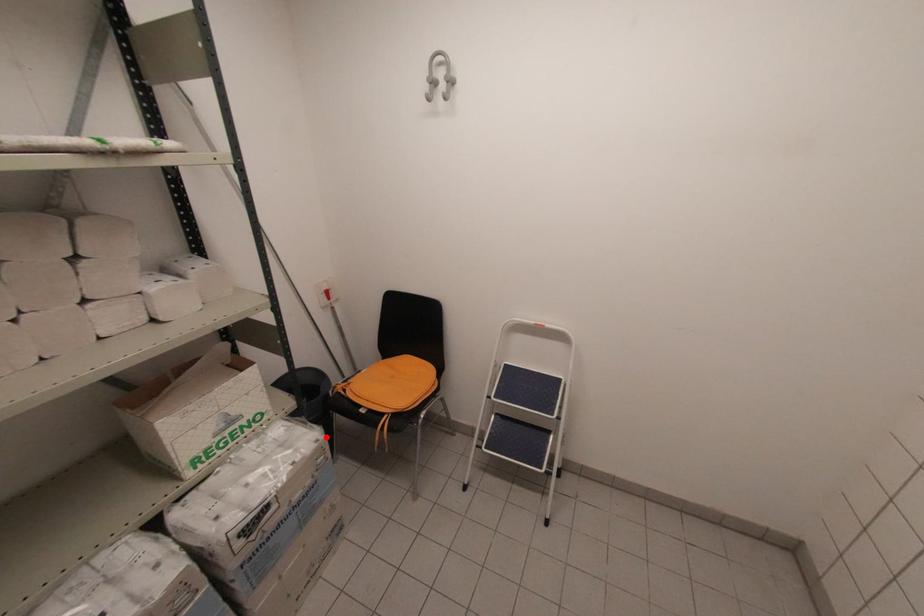
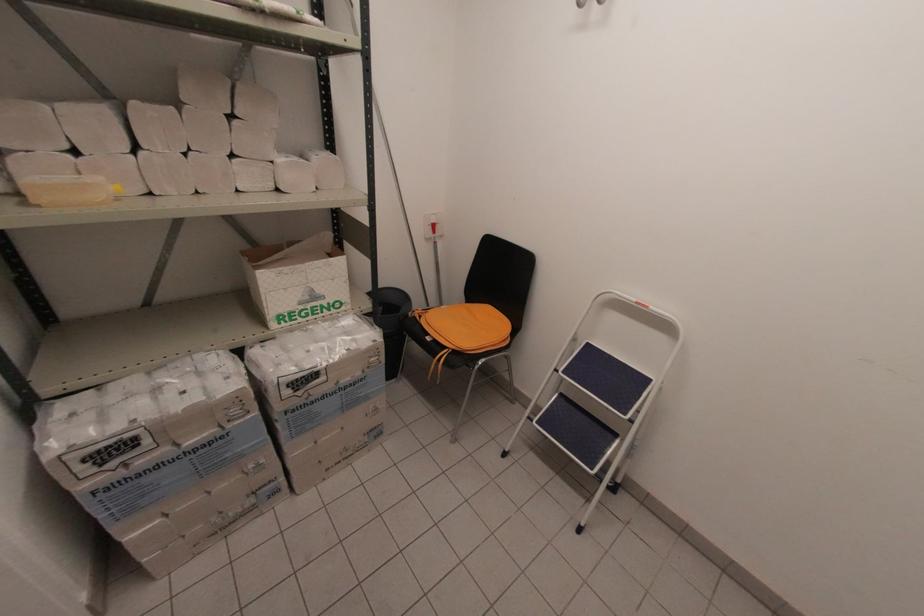
Where in the second image is the point corresponding to the highlighted location from the first image?

(383, 341)